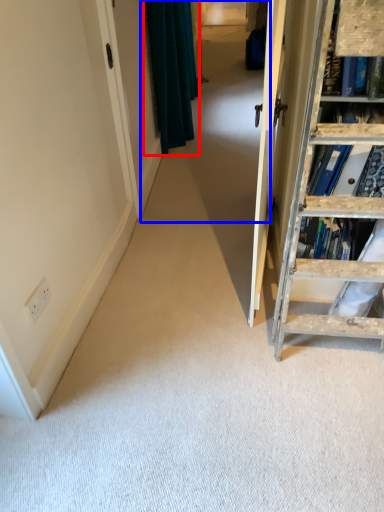
Question: Which of the following is the farthest to the observer, curtain (highlighted by a red box) or passage (highlighted by a blue box)?

Choices:
 (A) curtain
 (B) passage

Answer: (A)